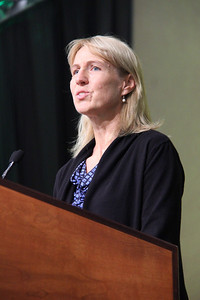
Find the location of a particular element. curtain is located at coordinates (46, 146).